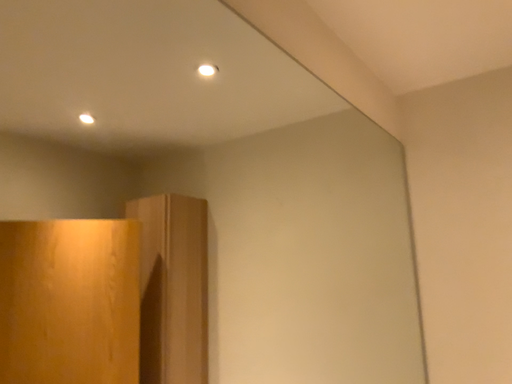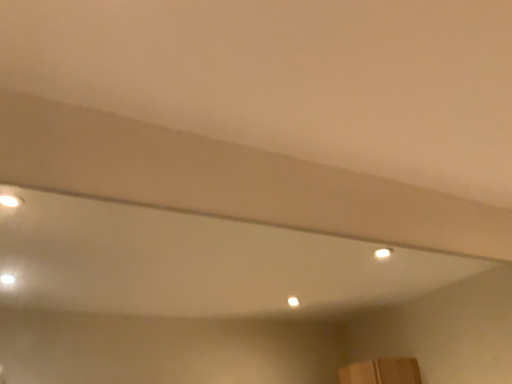
Question: Which way did the camera rotate in the video?

Choices:
 (A) rotated upward
 (B) rotated downward

Answer: (A)